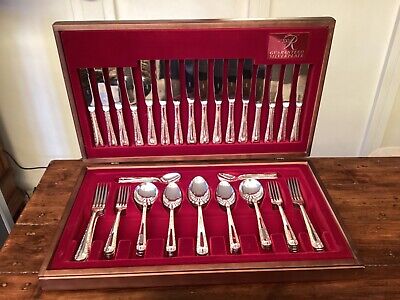
What are the coordinates of `spoons` in the screenshot? It's located at (170, 175), (148, 193), (174, 193), (200, 188), (227, 192), (224, 175), (253, 187).